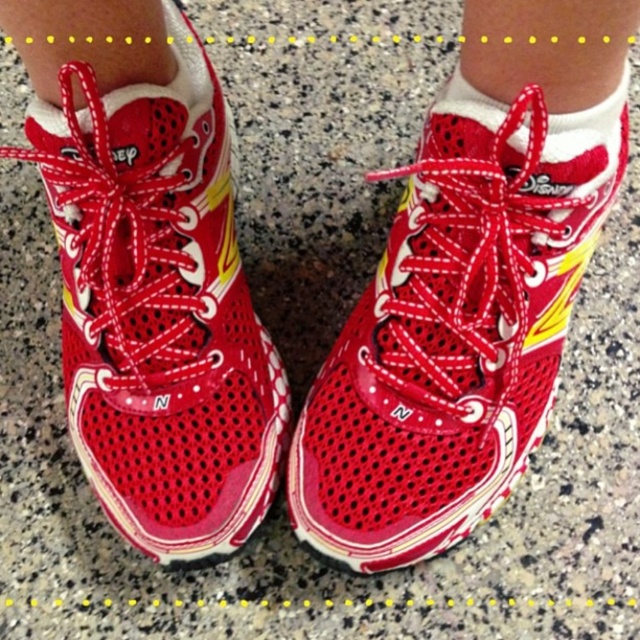
Who is more forward, (x=161, y=163) or (x=445, y=109)?

Point (x=445, y=109) is more forward.

Between matte mesh shoe at center and white soft sock at center, which one has less height?

white soft sock at center is shorter.

Where is `matte mesh shoe at center`? The width and height of the screenshot is (640, 640). matte mesh shoe at center is located at coordinates (157, 307).

Who is taller, shiny red mesh shoe at center or white soft sock at center?

With more height is shiny red mesh shoe at center.

Find the location of a particular element. This screenshot has height=640, width=640. shiny red mesh shoe at center is located at coordinates (454, 328).

Is point (524, 458) closer to camera compared to point (51, 156)?

No, it is behind (51, 156).

From the picture: Does shiny red mesh shoe at center have a greater width compared to matte mesh shoe at center?

Indeed, shiny red mesh shoe at center has a greater width compared to matte mesh shoe at center.

Is point (520, 198) in front of point (96, 102)?

No, (520, 198) is further to viewer.

Where is `shiny red mesh shoe at center`? The width and height of the screenshot is (640, 640). shiny red mesh shoe at center is located at coordinates (454, 328).